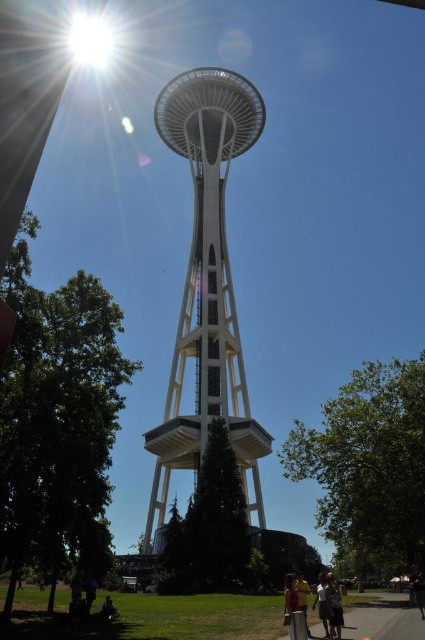
Question: Which object is closer to the camera taking this photo?

Choices:
 (A) dark brown hair at lower center
 (B) white glass tower at center
 (C) white cotton shirt at lower center
 (D) matte yellow shirt at lower center

Answer: (D)

Question: Which object is farther from the camera taking this photo?

Choices:
 (A) white glass tower at center
 (B) dark brown hair at lower center
 (C) white cotton shirt at lower center
 (D) matte yellow shirt at lower center

Answer: (A)

Question: Does white glass tower at center have a larger size compared to white cotton shirt at lower center?

Choices:
 (A) no
 (B) yes

Answer: (B)

Question: Does white cotton shirt at lower center have a smaller size compared to matte yellow shirt at lower center?

Choices:
 (A) no
 (B) yes

Answer: (B)

Question: Considering the real-world distances, which object is farthest from the white glass tower at center?

Choices:
 (A) matte yellow shirt at lower center
 (B) dark brown hair at lower center

Answer: (A)

Question: Does white glass tower at center appear on the left side of matte yellow shirt at lower center?

Choices:
 (A) no
 (B) yes

Answer: (B)